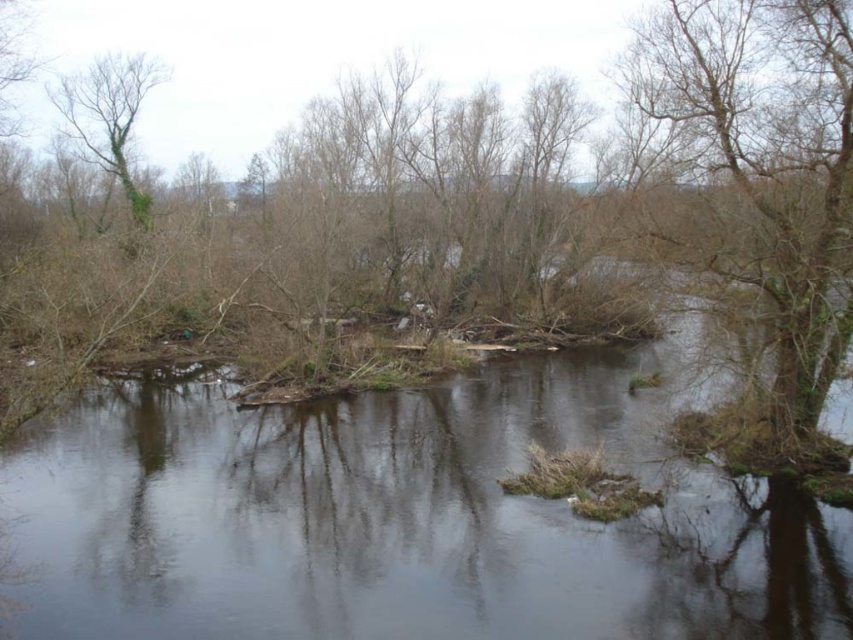
What do you see at coordinates (500, 228) in the screenshot?
I see `brown wood tree at center` at bounding box center [500, 228].

Who is positioned more to the left, brown wood tree at center or clear water at center?

Positioned to the left is clear water at center.

Where is `brown wood tree at center`? This screenshot has height=640, width=853. brown wood tree at center is located at coordinates (500, 228).

This screenshot has height=640, width=853. In order to click on brown wood tree at center in this screenshot , I will do `click(500, 228)`.

What do you see at coordinates (405, 516) in the screenshot?
I see `clear water at center` at bounding box center [405, 516].

Can you confirm if clear water at center is wider than green leafy tree at upper left?

Yes.

Between point (135, 548) and point (57, 83), which one is positioned in front?

Point (135, 548) is more forward.

At what (x,y) coordinates should I click in order to perform the action: click on clear water at center. Please return your answer as a coordinate pair (x, y). This screenshot has height=640, width=853. Looking at the image, I should click on (405, 516).

Can you confirm if clear water at center is positioned below bare branches at right?

Correct, clear water at center is located below bare branches at right.

Between clear water at center and bare branches at right, which one is positioned higher?

Positioned higher is bare branches at right.

Where is `clear water at center`? clear water at center is located at coordinates (405, 516).